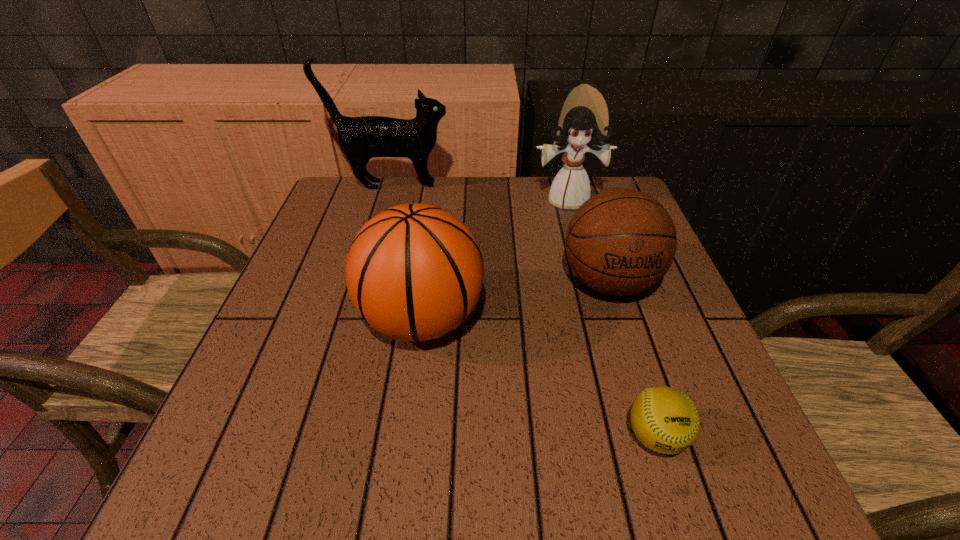
In order to click on vacant area in the image that satisfies the following two spatial constraints: 1. on the face of the left basketball; 2. on the left side of the cat in this screenshot , I will do `click(352, 319)`.

Image resolution: width=960 pixels, height=540 pixels. Identify the location of vacant area that satisfies the following two spatial constraints: 1. on the face of the left basketball; 2. on the right side of the cat. (352, 319).

At what (x,y) coordinates should I click in order to perform the action: click on vacant position in the image that satisfies the following two spatial constraints: 1. on the face of the left basketball; 2. on the left side of the cat. Please return your answer as a coordinate pair (x, y). The height and width of the screenshot is (540, 960). Looking at the image, I should click on (352, 319).